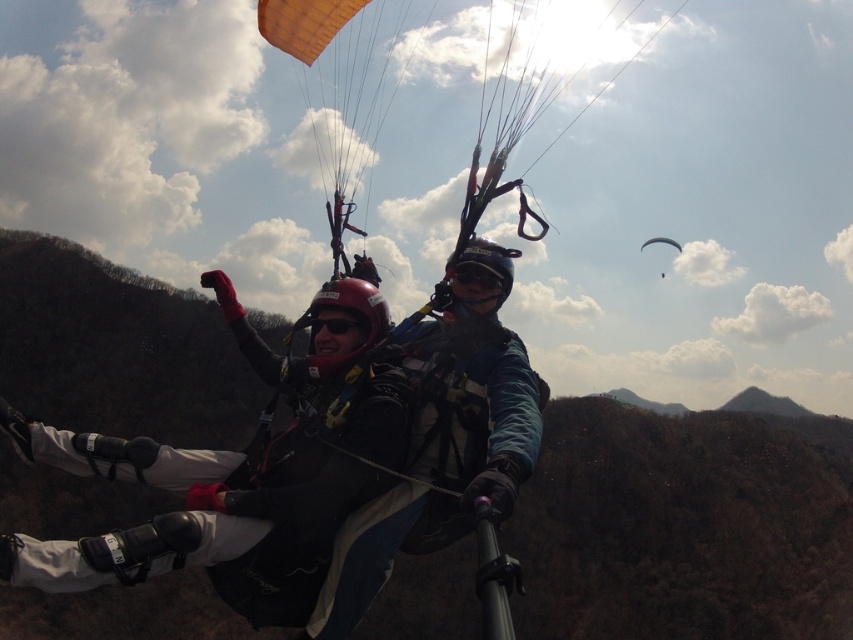
Does brown textured mountain at center have a greater width compared to matte black helmet at center?

Yes.

Does brown textured mountain at center appear on the right side of matte black helmet at center?

Indeed, brown textured mountain at center is positioned on the right side of matte black helmet at center.

You are a GUI agent. You are given a task and a screenshot of the screen. Output one action in this format:
    pyautogui.click(x=<x>, y=<y>)
    Task: Click on the brown textured mountain at center
    This screenshot has height=640, width=853.
    Given the screenshot: What is the action you would take?
    pyautogui.click(x=683, y=525)

Identify the location of brown textured mountain at center. (683, 525).

Does point (209, 353) lie in front of point (666, 241)?

Yes, it is in front of point (666, 241).

Which is in front, point (723, 428) or point (666, 237)?

Point (666, 237) is in front.

Locate an element on the screen. The width and height of the screenshot is (853, 640). brown textured mountain at center is located at coordinates (683, 525).

Is point (289, 579) positioned before point (680, 248)?

Yes.

Between matte black helmet at center and white matte parachute at upper center, which one has less height?

With less height is white matte parachute at upper center.

Is point (238, 500) closer to viewer compared to point (659, 237)?

Yes.

The width and height of the screenshot is (853, 640). What are the coordinates of `matte black helmet at center` in the screenshot? It's located at (241, 472).